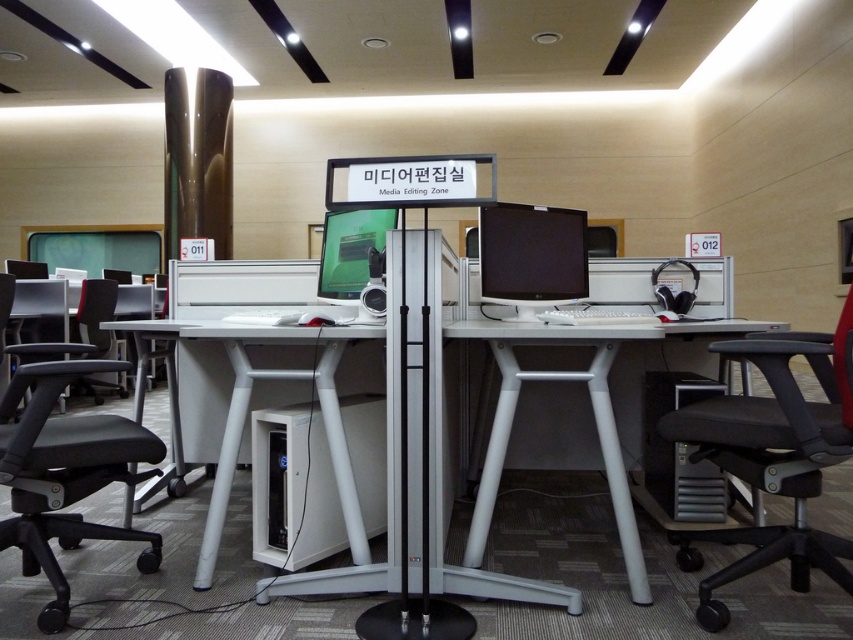
Does white plastic table at center have a smaller size compared to matte black monitor at center?

No.

Is point (450, 332) in front of point (535, 243)?

Yes, it is in front of point (535, 243).

Find the location of a particular element. white plastic table at center is located at coordinates (590, 404).

Image resolution: width=853 pixels, height=640 pixels. Describe the element at coordinates (590, 404) in the screenshot. I see `white plastic table at center` at that location.

From the picture: Which is more to the right, white plastic table at center or black fabric chair at lower left?

white plastic table at center is more to the right.

Who is more distant from viewer, [466,554] or [105,296]?

Point [105,296]

I want to click on white plastic table at center, so click(x=590, y=404).

Is green glossy monitor at center to the right of black fabric chair at lower left from the viewer's perspective?

Indeed, green glossy monitor at center is positioned on the right side of black fabric chair at lower left.

This screenshot has height=640, width=853. I want to click on green glossy monitor at center, so click(351, 252).